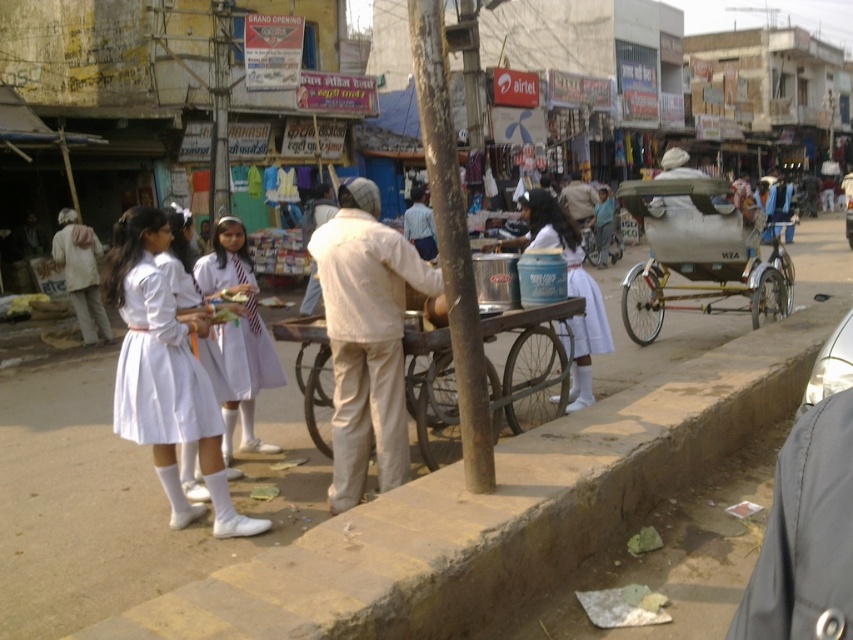
Which is behind, point (251, 406) or point (496, 312)?

Point (251, 406)

The width and height of the screenshot is (853, 640). I want to click on white uniform at center, so click(239, 332).

The height and width of the screenshot is (640, 853). I want to click on white uniform at center, so coord(239,332).

The height and width of the screenshot is (640, 853). Identify the location of white uniform at center. (239, 332).

Who is positioned more to the left, white cotton dress at left or metallic silver cart at center?

From the viewer's perspective, white cotton dress at left appears more on the left side.

Who is higher up, white cotton dress at left or metallic silver cart at center?

Positioned higher is metallic silver cart at center.

The height and width of the screenshot is (640, 853). What do you see at coordinates (160, 369) in the screenshot?
I see `white cotton dress at left` at bounding box center [160, 369].

You are a GUI agent. You are given a task and a screenshot of the screen. Output one action in this format:
    pyautogui.click(x=<x>, y=<y>)
    Task: Click on the white cotton dress at left
    
    Given the screenshot: What is the action you would take?
    pyautogui.click(x=160, y=369)

Does white uniform dress at lower left have a greater width compared to white fabric dress at center?

Yes.

Does white uniform dress at lower left lie behind white fabric dress at center?

No, it is not.

This screenshot has height=640, width=853. Identify the location of white uniform dress at lower left. (165, 372).

Find the location of a particular element. This screenshot has width=853, height=640. white uniform dress at lower left is located at coordinates (165, 372).